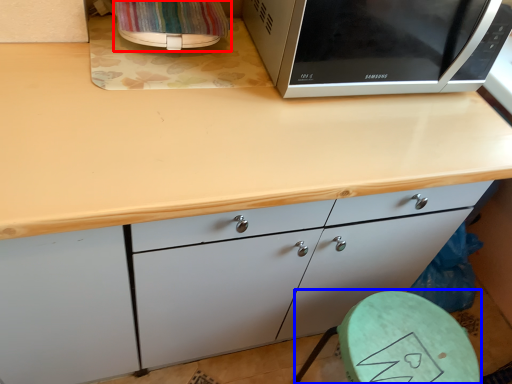
Question: Among these objects, which one is farthest to the camera, appliance (highlighted by a red box) or round table (highlighted by a blue box)?

Choices:
 (A) appliance
 (B) round table

Answer: (B)